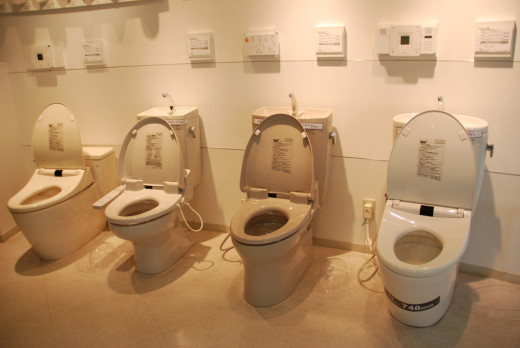
Image resolution: width=520 pixels, height=348 pixels. What are the coordinates of `silver handle` in the screenshot? It's located at (491, 148).